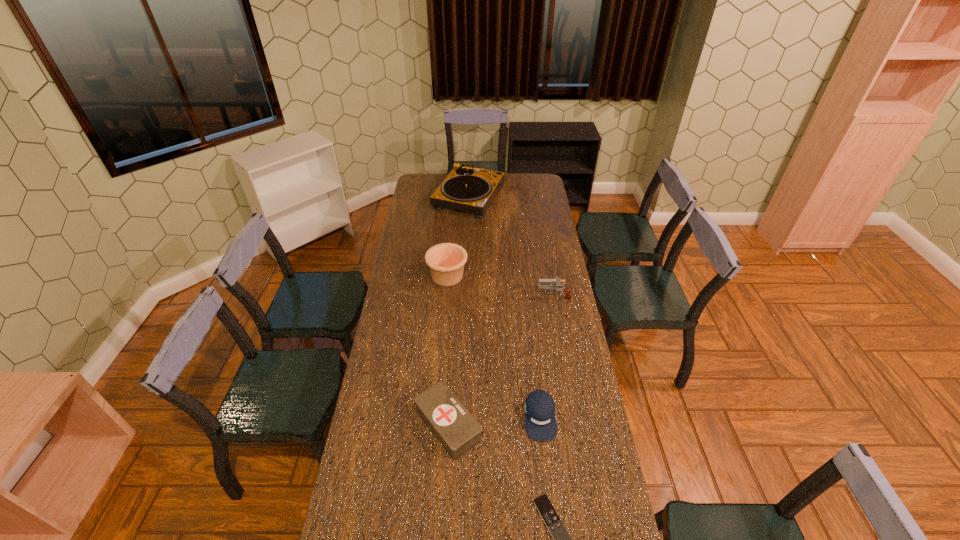
Where is `vacant region at the right edge of the desktop`? The image size is (960, 540). vacant region at the right edge of the desktop is located at coordinates [530, 212].

Image resolution: width=960 pixels, height=540 pixels. I want to click on vacant point located between the baseball cap and the first-aid kit, so click(494, 421).

This screenshot has width=960, height=540. I want to click on vacant area that lies between the pottery and the record player, so click(458, 237).

Where is `object that is the fifth nearest to the first-aid kit`? The width and height of the screenshot is (960, 540). object that is the fifth nearest to the first-aid kit is located at coordinates (468, 189).

Select which object is the closest to the gun. Please provide its 2D coordinates. Your answer should be formatted as a tuple, i.e. [(x, y)], where the tuple contains the x and y coordinates of a point satisfying the conditions above.

[(446, 261)]

Find the location of `vacant point that satisfies the following two spatial constraints: 1. on the back side of the farthest object; 2. on the right side of the pottery`. vacant point that satisfies the following two spatial constraints: 1. on the back side of the farthest object; 2. on the right side of the pottery is located at coordinates (454, 197).